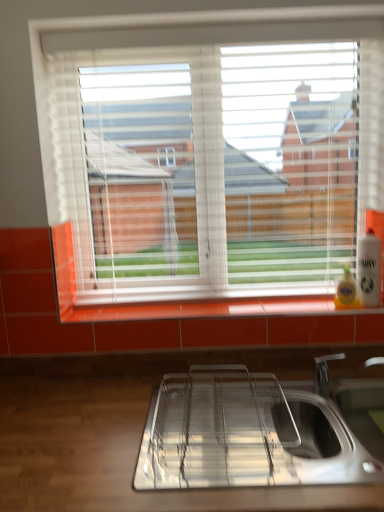
Question: Would you say white plastic bottle at right is a long distance from white plastic blinds at upper center?

Choices:
 (A) no
 (B) yes

Answer: (A)

Question: Can you confirm if white plastic bottle at right is smaller than white plastic blinds at upper center?

Choices:
 (A) yes
 (B) no

Answer: (A)

Question: From a real-world perspective, is white plastic bottle at right below white plastic blinds at upper center?

Choices:
 (A) yes
 (B) no

Answer: (A)

Question: Is white plastic blinds at upper center located within white plastic bottle at right?

Choices:
 (A) yes
 (B) no

Answer: (B)

Question: Does white plastic bottle at right have a lesser width compared to white plastic blinds at upper center?

Choices:
 (A) no
 (B) yes

Answer: (B)

Question: Which is correct: white plastic bottle at right is inside polished stainless steel sink at lower center, or outside of it?

Choices:
 (A) inside
 (B) outside

Answer: (B)

Question: From their relative heights in the image, would you say white plastic bottle at right is taller or shorter than polished stainless steel sink at lower center?

Choices:
 (A) short
 (B) tall

Answer: (A)

Question: Looking at the image, does white plastic bottle at right seem bigger or smaller compared to polished stainless steel sink at lower center?

Choices:
 (A) big
 (B) small

Answer: (B)

Question: Based on their positions, is white plastic bottle at right located to the left or right of polished stainless steel sink at lower center?

Choices:
 (A) left
 (B) right

Answer: (B)

Question: Based on their positions, is polished stainless steel sink at lower center located to the left or right of white plastic bottle at right?

Choices:
 (A) right
 (B) left

Answer: (B)

Question: Does point (264, 445) appear closer or farther from the camera than point (362, 294)?

Choices:
 (A) closer
 (B) farther

Answer: (A)

Question: Looking at their shapes, would you say polished stainless steel sink at lower center is wider or thinner than white plastic bottle at right?

Choices:
 (A) wide
 (B) thin

Answer: (A)

Question: Based on their sizes in the image, would you say polished stainless steel sink at lower center is bigger or smaller than white plastic bottle at right?

Choices:
 (A) big
 (B) small

Answer: (A)

Question: Looking at the image, does white plastic blinds at upper center seem bigger or smaller compared to polished stainless steel sink at lower center?

Choices:
 (A) small
 (B) big

Answer: (B)

Question: Considering the positions of white plastic blinds at upper center and polished stainless steel sink at lower center in the image, is white plastic blinds at upper center wider or thinner than polished stainless steel sink at lower center?

Choices:
 (A) thin
 (B) wide

Answer: (A)